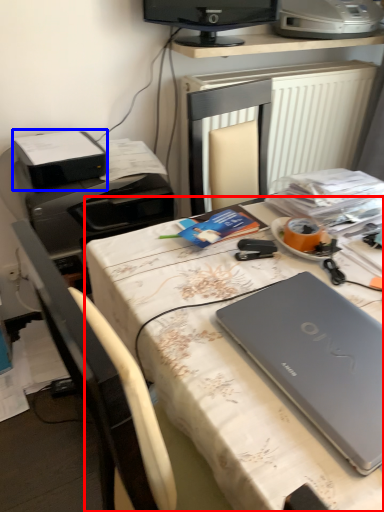
Question: Which object is closer to the camera taking this photo, desk (highlighted by a red box) or printer (highlighted by a blue box)?

Choices:
 (A) desk
 (B) printer

Answer: (A)